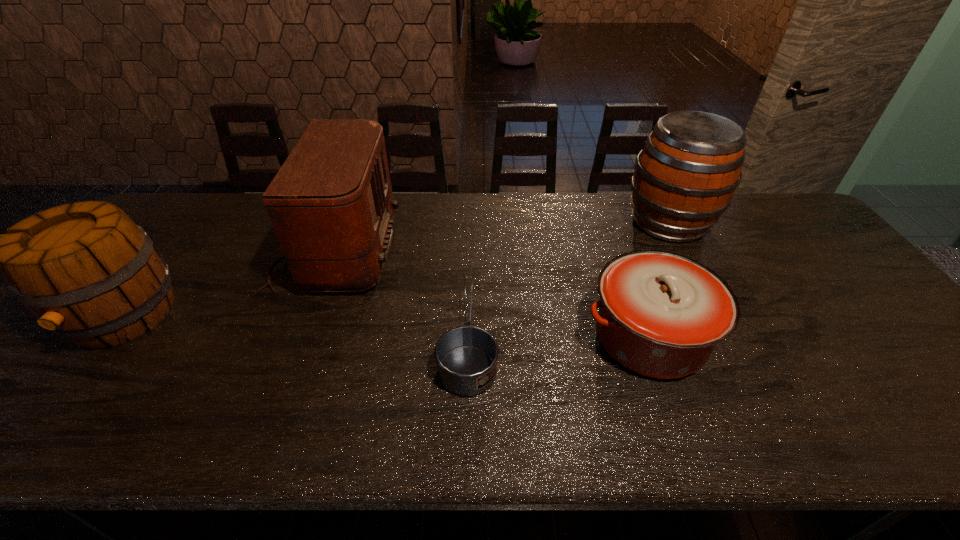
Find the location of a particular element. The image size is (960, 540). object that is the second closest one to the third object from right to left is located at coordinates (661, 314).

Locate an element on the screen. The image size is (960, 540). the fourth closest object relative to the casserole is located at coordinates pyautogui.click(x=86, y=271).

Where is `free point that satisfies the following two spatial constraints: 1. with the handle extending from one side of the shortest object; 2. on the left side of the casserole`? Image resolution: width=960 pixels, height=540 pixels. free point that satisfies the following two spatial constraints: 1. with the handle extending from one side of the shortest object; 2. on the left side of the casserole is located at coordinates (468, 338).

Locate an element on the screen. This screenshot has height=540, width=960. free location that satisfies the following two spatial constraints: 1. on the side of the shorter cider where the spigot is located; 2. on the left side of the casserole is located at coordinates (106, 338).

At what (x,y) coordinates should I click in order to perform the action: click on vacant space that satisfies the following two spatial constraints: 1. on the front panel of the fourth object from right to left; 2. with the handle extending from one side of the saucepan. Please return your answer as a coordinate pair (x, y). The width and height of the screenshot is (960, 540). Looking at the image, I should click on (302, 340).

I want to click on free point that satisfies the following two spatial constraints: 1. on the front panel of the radio receiver; 2. on the right side of the second shortest object, so click(x=303, y=338).

At what (x,y) coordinates should I click in order to perform the action: click on free region that satisfies the following two spatial constraints: 1. on the front panel of the radio receiver; 2. with the handle extending from one side of the saucepan. Please return your answer as a coordinate pair (x, y). The width and height of the screenshot is (960, 540). Looking at the image, I should click on click(x=302, y=340).